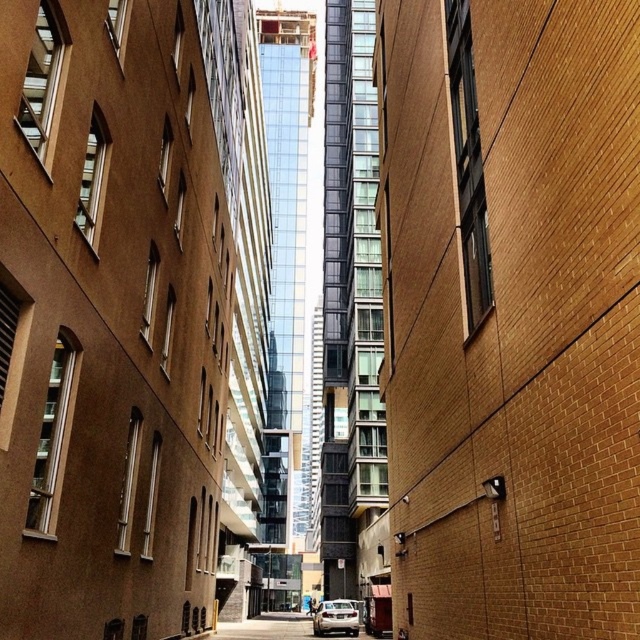
Question: Among these objects, which one is farthest from the camera?

Choices:
 (A) silver metallic car at lower center
 (B) brown brick wall at center

Answer: (A)

Question: Is brown brick wall at center to the right of silver metallic car at lower center from the viewer's perspective?

Choices:
 (A) no
 (B) yes

Answer: (B)

Question: Can you confirm if brown brick wall at center is positioned below silver metallic car at lower center?

Choices:
 (A) yes
 (B) no

Answer: (B)

Question: Is brown brick wall at center to the left of silver metallic car at lower center from the viewer's perspective?

Choices:
 (A) no
 (B) yes

Answer: (A)

Question: Which point is closer to the camera taking this photo?

Choices:
 (A) (340, 602)
 (B) (493, 172)

Answer: (B)

Question: Among these points, which one is nearest to the camera?

Choices:
 (A) (561, 262)
 (B) (342, 602)

Answer: (A)